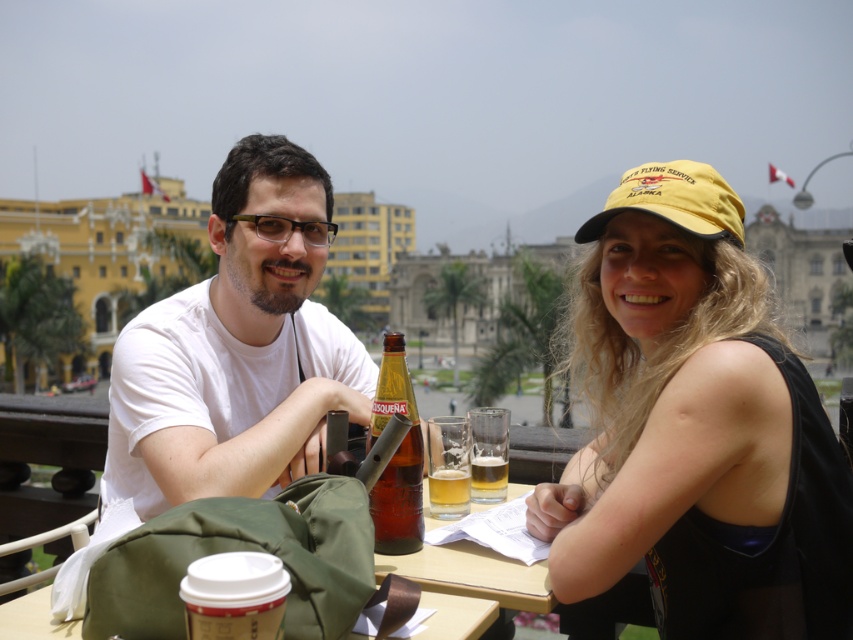
From the picture: You are a photographer standing at a certain distance from the brown glass bottle at center. You want to take a clear photo of it. If your camera can focus on objects up to 150 feet away, will you be able to capture the bottle clearly?

The brown glass bottle at center is 153.10 feet away from the camera, which exceeds the camera maximum focusing distance of 150 feet. Therefore, the camera cannot focus on the bottle clearly.